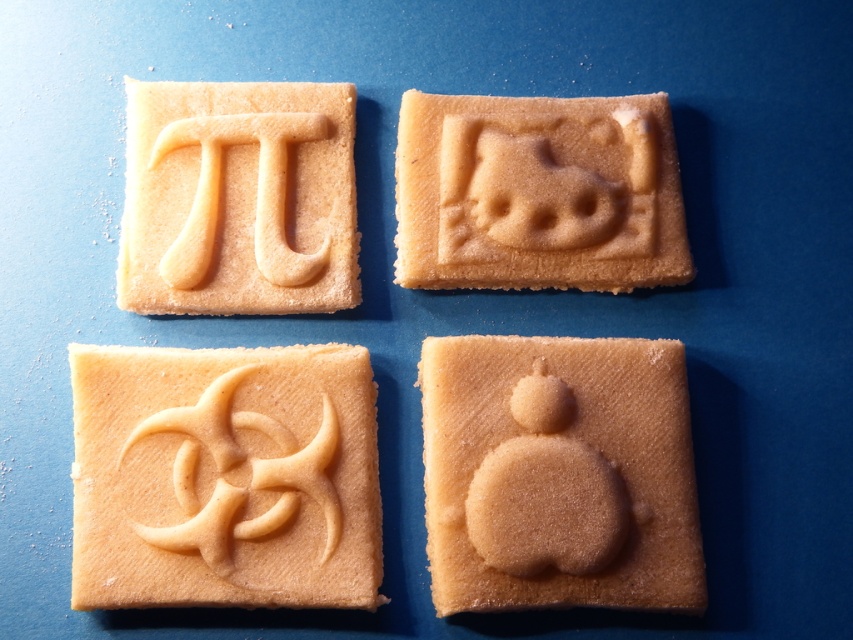
You are holding a cookie jar and want to place the matte brown cookie at bottom right and the matte beige cookie at upper left into it. Based on their positions in the image, which cookie should you pick up first to maintain the original arrangement?

You should pick up the matte beige cookie at upper left first because the matte brown cookie at bottom right is in front of it. To maintain the original arrangement, you need to place the matte beige cookie at upper left first so that the matte brown cookie at bottom right can be placed in front of it later.

You are a baker trying to arrange cookies on a platter. You have two specific cookies to place next to each other. The matte brown cookie at bottom right and the matte yellow gingerbread at upper right. Which cookie should you place first if you want the wider cookie to be on the left side of the platter?

The matte yellow gingerbread at upper right is wider than the matte brown cookie at bottom right. To have the wider cookie on the left, place the matte yellow gingerbread at upper right first on the left side, followed by the matte brown cookie at bottom right on the right side.